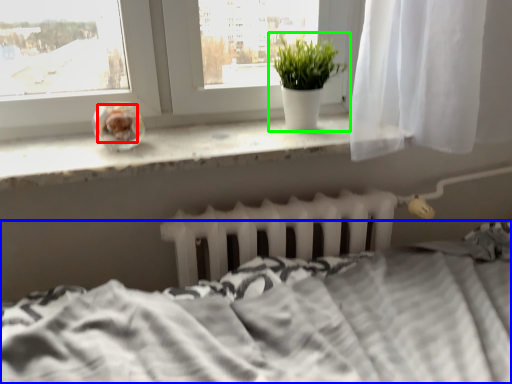
Question: Which object is the farthest from food (highlighted by a red box)? Choose among these: bed (highlighted by a blue box) or houseplant (highlighted by a green box).

Choices:
 (A) bed
 (B) houseplant

Answer: (A)